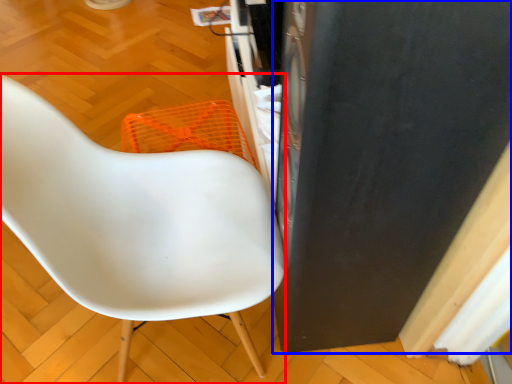
Question: Among these objects, which one is farthest to the camera, chair (highlighted by a red box) or appliance (highlighted by a blue box)?

Choices:
 (A) chair
 (B) appliance

Answer: (A)